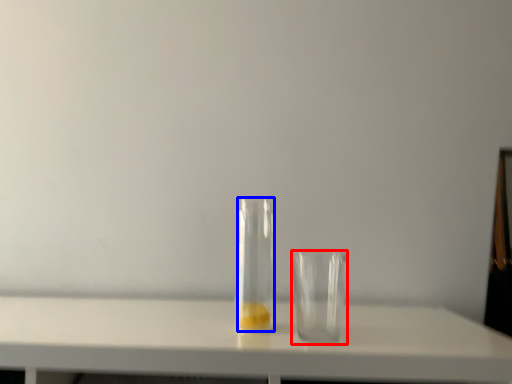
Question: Which of the following is the farthest to the observer, tableware (highlighted by a red box) or bottle (highlighted by a blue box)?

Choices:
 (A) tableware
 (B) bottle

Answer: (B)